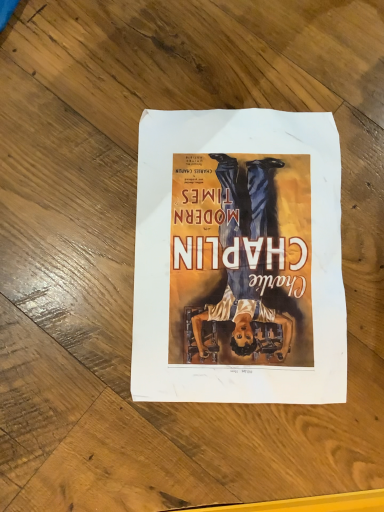
In the scene shown: Measure the distance between matte paper poster at center and camera.

The distance of matte paper poster at center from camera is 15.91 inches.

What do you see at coordinates (239, 259) in the screenshot? This screenshot has width=384, height=512. I see `matte paper poster at center` at bounding box center [239, 259].

This screenshot has width=384, height=512. I want to click on matte paper poster at center, so click(x=239, y=259).

Identify the location of matte paper poster at center. (239, 259).